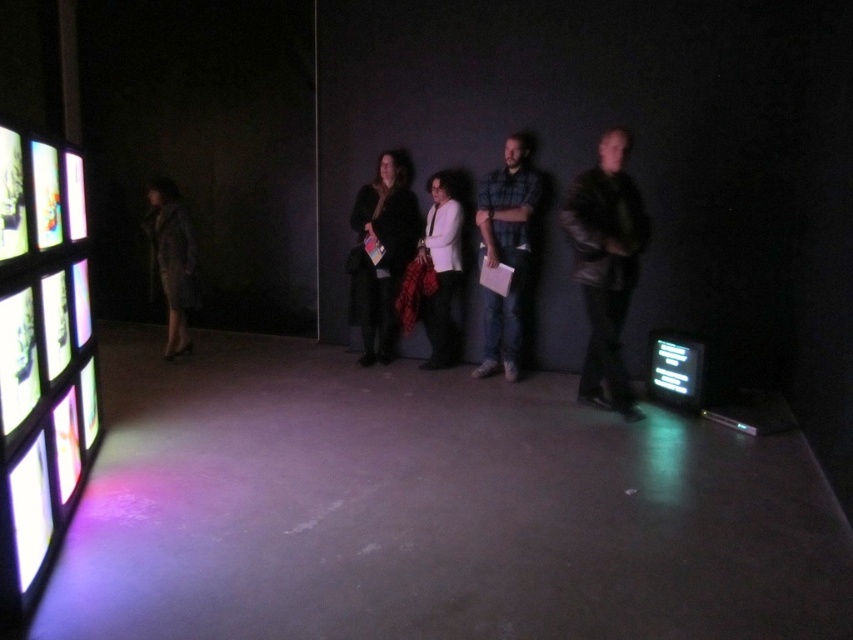
You are an art critic attending an exhibition and notice the matte gray coat at left and the black glossy screen at lower right. Which object is closer to you?

The matte gray coat at left is closer to you because it is further to the viewer than the black glossy screen at lower right.

From the picture: You are an artist in the gallery looking to place a new sculpture between the black wool coat at center and the plaid flannel shirt at center. Which clothing item should you stand closer to while positioning the sculpture?

You should stand closer to the black wool coat at center because it is closer to you than the plaid flailed shirt at center, so positioning the sculpture between them requires adjusting your position relative to the closer item.